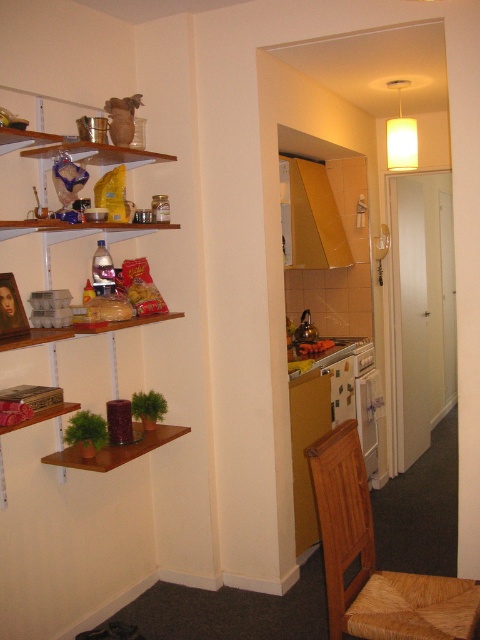
Question: Which object is closer to the camera taking this photo?

Choices:
 (A) smooth plastic container at center
 (B) gold cardboard exhaust hood at upper center
 (C) woven straw chair at lower right

Answer: (C)

Question: Is woven straw chair at lower right to the right of wooden shelves at left from the viewer's perspective?

Choices:
 (A) no
 (B) yes

Answer: (B)

Question: Which of the following is the farthest from the observer?

Choices:
 (A) gold cardboard exhaust hood at upper center
 (B) wooden shelves at left

Answer: (A)

Question: Which of the following is the farthest from the observer?

Choices:
 (A) (133, 236)
 (B) (327, 344)

Answer: (B)

Question: Is wooden shelves at left bigger than smooth plastic container at center?

Choices:
 (A) yes
 (B) no

Answer: (A)

Question: Where is wooden shelves at left located in relation to smooth plastic container at center in the image?

Choices:
 (A) above
 (B) below

Answer: (A)